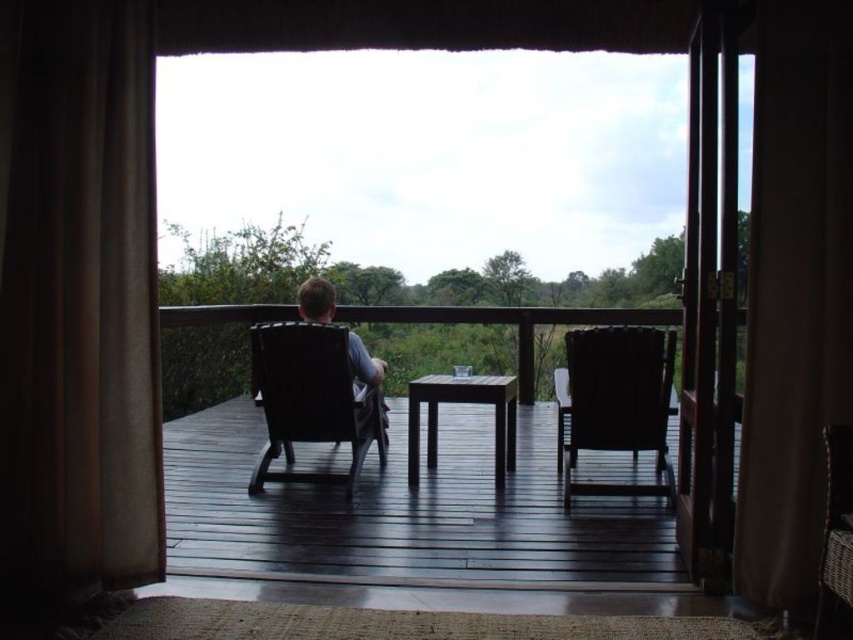
Question: Which object appears farthest from the camera in this image?

Choices:
 (A) transparent plastic screen door at right
 (B) dark brown wooden table at center
 (C) matte black chair at center

Answer: (B)

Question: In this image, where is matte black chair at center located relative to woven brown armchair at right?

Choices:
 (A) right
 (B) left

Answer: (B)

Question: Which is nearer to the brown fabric curtain at left?

Choices:
 (A) dark brown wooden table at center
 (B) transparent glass door at center

Answer: (B)

Question: Does brown fabric curtain at left appear on the right side of dark wood deck at center?

Choices:
 (A) yes
 (B) no

Answer: (B)

Question: Which object is positioned farthest from the dark brown wooden table at center?

Choices:
 (A) transparent plastic screen door at right
 (B) dark brown wood armchair at center

Answer: (A)

Question: Observing the image, what is the correct spatial positioning of transparent glass door at center in reference to dark brown wooden table at center?

Choices:
 (A) right
 (B) left

Answer: (A)